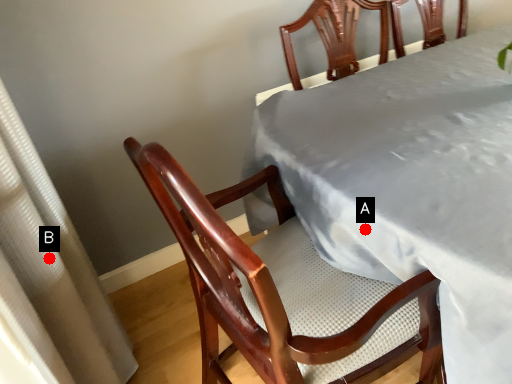
Question: Two points are circled on the image, labeled by A and B beside each circle. Which point is closer to the camera?

Choices:
 (A) A is closer
 (B) B is closer

Answer: (B)